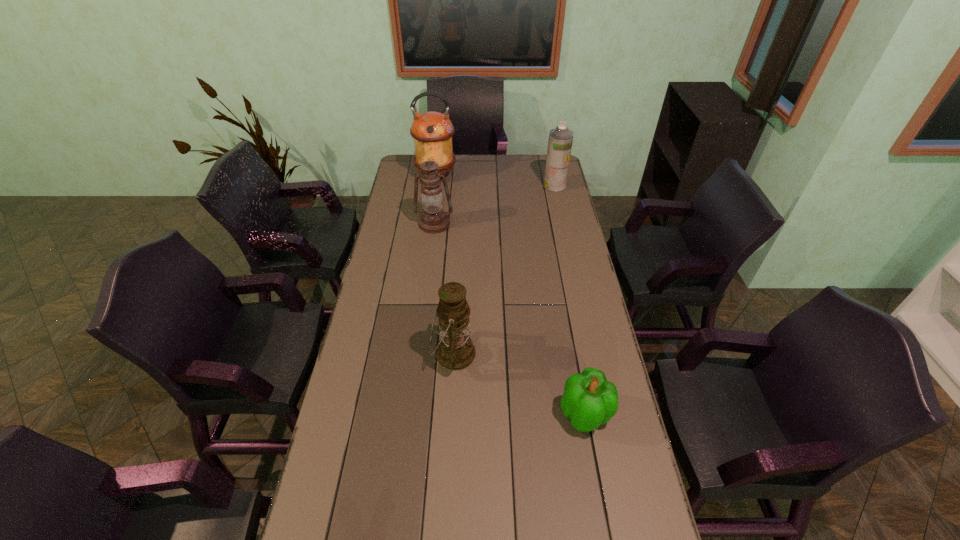
Find the location of `the farthest oil lamp`. the farthest oil lamp is located at coordinates (432, 131).

This screenshot has width=960, height=540. I want to click on the tallest object, so click(432, 131).

I want to click on aerosol can, so click(x=560, y=141).

The image size is (960, 540). What are the coordinates of `the second nearest oil lamp` in the screenshot? It's located at point(434,219).

This screenshot has width=960, height=540. I want to click on the fourth farthest object, so click(455, 351).

Locate an element on the screen. Image resolution: width=960 pixels, height=540 pixels. bell pepper is located at coordinates (590, 400).

You are a GUI agent. You are given a task and a screenshot of the screen. Output one action in this format:
    pyautogui.click(x=<x>, y=<y>)
    Task: Click on the nearest object
    
    Given the screenshot: What is the action you would take?
    [590, 400]

You are a GUI agent. You are given a task and a screenshot of the screen. Output one action in this format:
    pyautogui.click(x=<x>, y=<y>)
    Task: Click on the vacant space situated on the right of the tallest oil lamp
    
    Given the screenshot: What is the action you would take?
    pyautogui.click(x=535, y=175)

Locate an element on the screen. Image resolution: width=960 pixels, height=540 pixels. free space located 0.170m on the back of the aerosol can is located at coordinates (549, 162).

Image resolution: width=960 pixels, height=540 pixels. I want to click on free space located on the front of the third farthest object, so click(424, 303).